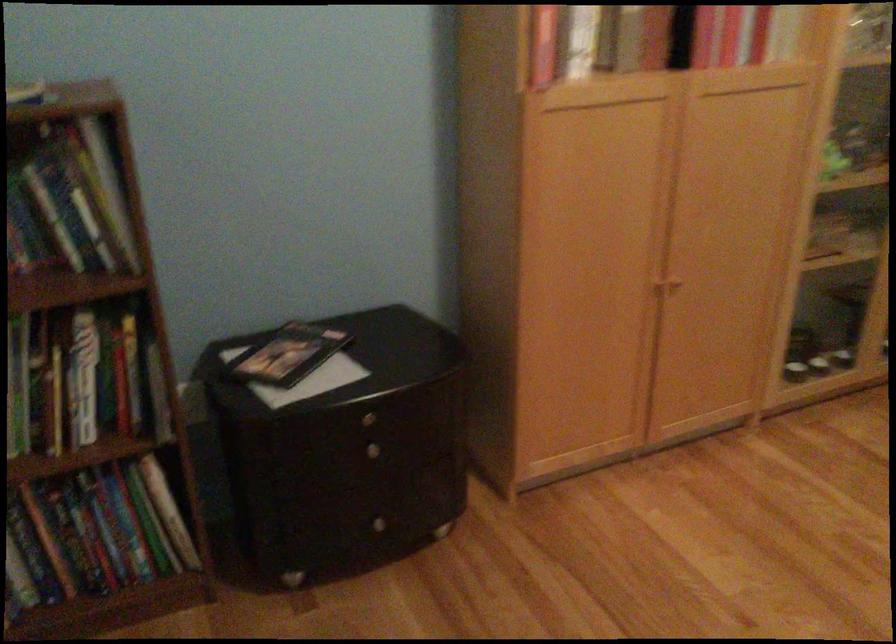
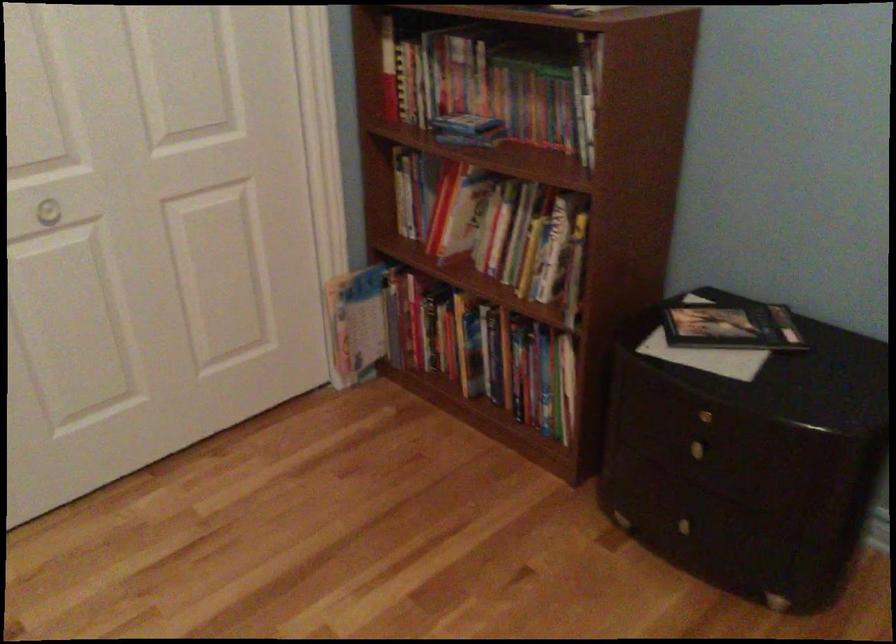
In the second image, find the point that corresponds to point 451,529 in the first image.

(780, 603)